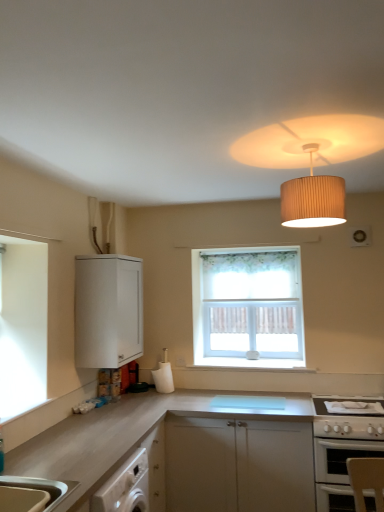
This screenshot has height=512, width=384. Describe the element at coordinates (107, 434) in the screenshot. I see `satin white countertop at center` at that location.

Image resolution: width=384 pixels, height=512 pixels. What do you see at coordinates (313, 198) in the screenshot?
I see `beige pleated lampshade at upper center` at bounding box center [313, 198].

The width and height of the screenshot is (384, 512). What do you see at coordinates (248, 307) in the screenshot?
I see `white floral curtain at center` at bounding box center [248, 307].

Describe the element at coordinates (347, 421) in the screenshot. The height and width of the screenshot is (512, 384). I see `white glossy gas stove at lower right` at that location.

The width and height of the screenshot is (384, 512). In order to click on white matte cabinet at upper left in this screenshot , I will do `click(108, 311)`.

Identify the location of satin white countertop at center. (107, 434).

Considering the positions of objects white glossy oven at lower right and white glossy gas stove at lower right in the image provided, who is more to the left, white glossy oven at lower right or white glossy gas stove at lower right?

white glossy oven at lower right.

Can you confirm if white glossy oven at lower right is smaller than white glossy gas stove at lower right?

Actually, white glossy oven at lower right might be larger than white glossy gas stove at lower right.

What are the coordinates of `gas stove that appears on the right of white glossy oven at lower right` in the screenshot? It's located at (347, 421).

In the image, is white glossy oven at lower right on the left side or the right side of satin white countertop at center?

white glossy oven at lower right is to the right of satin white countertop at center.

In the image, there is a satin white countertop at center. In order to click on oven below it (from the image's perspective) in this screenshot , I will do (342, 451).

Is white glossy oven at lower right not near satin white countertop at center?

No.

Is white glossy oven at lower right positioned beyond the bounds of satin white countertop at center?

Indeed, white glossy oven at lower right is completely outside satin white countertop at center.

Considering the sizes of objects white glossy gas stove at lower right and satin white countertop at center in the image provided, who is smaller, white glossy gas stove at lower right or satin white countertop at center?

With smaller size is white glossy gas stove at lower right.

Are white glossy gas stove at lower right and satin white countertop at center far apart?

They are positioned close to each other.

Is white glossy gas stove at lower right to the left of satin white countertop at center from the viewer's perspective?

No.

Is white matte cabinet at upper left turned away from white floral curtain at center?

That's not correct — white matte cabinet at upper left is not looking away from white floral curtain at center.

Can you confirm if white matte cabinet at upper left is shorter than white floral curtain at center?

Correct, white matte cabinet at upper left is not as tall as white floral curtain at center.

Is white matte cabinet at upper left directly adjacent to white floral curtain at center?

There is a gap between white matte cabinet at upper left and white floral curtain at center.

From the image's perspective, which object appears higher, satin white countertop at center or white glossy gas stove at lower right?

white glossy gas stove at lower right, from the image's perspective.

Is satin white countertop at center turned away from white glossy gas stove at lower right?

No, white glossy gas stove at lower right is not at the back of satin white countertop at center.

Is point (70, 424) less distant than point (371, 437)?

Yes, it is in front of point (371, 437).

Can you see beige pleated lampshade at upper center touching white glossy oven at lower right?

No, beige pleated lampshade at upper center is not next to white glossy oven at lower right.

From a real-world perspective, who is located lower, beige pleated lampshade at upper center or white glossy oven at lower right?

In real-world perspective, white glossy oven at lower right is lower.

Locate an element on the screen. The width and height of the screenshot is (384, 512). oven located behind the beige pleated lampshade at upper center is located at coordinates (342, 451).

In the scene shown: Can you confirm if beige pleated lampshade at upper center is smaller than white glossy oven at lower right?

Yes, beige pleated lampshade at upper center is smaller than white glossy oven at lower right.

Considering the positions of point (316, 192) and point (145, 428), is point (316, 192) closer or farther from the camera than point (145, 428)?

Clearly, point (316, 192) is closer to the camera than point (145, 428).

Considering the relative sizes of beige pleated lampshade at upper center and satin white countertop at center in the image provided, is beige pleated lampshade at upper center thinner than satin white countertop at center?

Yes.

Is beige pleated lampshade at upper center looking in the opposite direction of satin white countertop at center?

No, beige pleated lampshade at upper center is not facing the opposite direction of satin white countertop at center.

Locate an element on the screen. This screenshot has width=384, height=512. gas stove that appears above the white glossy oven at lower right (from a real-world perspective) is located at coordinates (x=347, y=421).

Where is `countertop behind the white glossy oven at lower right`? The height and width of the screenshot is (512, 384). countertop behind the white glossy oven at lower right is located at coordinates (107, 434).

Looking at the image, which one is located further to satin white countertop at center, white floral curtain at center or white matte cabinet at upper left?

Based on the image, white floral curtain at center appears to be further to satin white countertop at center.

Considering their positions, is white matte cabinet at upper left positioned further to white glossy oven at lower right than beige pleated lampshade at upper center?

white matte cabinet at upper left.

Estimate the real-world distances between objects in this image. Which object is further from white floral curtain at center, white glossy gas stove at lower right or satin white countertop at center?

The object further to white floral curtain at center is satin white countertop at center.

Looking at the image, which one is located further to white matte cabinet at upper left, satin white countertop at center or white glossy gas stove at lower right?

The object further to white matte cabinet at upper left is white glossy gas stove at lower right.

Considering their positions, is beige pleated lampshade at upper center positioned further to white glossy oven at lower right than white floral curtain at center?

beige pleated lampshade at upper center is positioned further to the anchor white glossy oven at lower right.

Looking at the image, which one is located further to white floral curtain at center, white glossy oven at lower right or satin white countertop at center?

Among the two, satin white countertop at center is located further to white floral curtain at center.

Which object lies further to the anchor point white floral curtain at center, white glossy oven at lower right or white matte cabinet at upper left?

Based on the image, white glossy oven at lower right appears to be further to white floral curtain at center.

From the picture: Estimate the real-world distances between objects in this image. Which object is further from satin white countertop at center, white glossy gas stove at lower right or white floral curtain at center?

white floral curtain at center is further to satin white countertop at center.

The width and height of the screenshot is (384, 512). Find the location of `oven between satin white countertop at center and white glossy gas stove at lower right in the horizontal direction`. oven between satin white countertop at center and white glossy gas stove at lower right in the horizontal direction is located at coordinates (342, 451).

Locate an element on the screen. The width and height of the screenshot is (384, 512). gas stove located between white glossy oven at lower right and white floral curtain at center in the depth direction is located at coordinates tap(347, 421).

Where is `cabinetry between beige pleated lampshade at upper center and white glossy oven at lower right in the up-down direction`? cabinetry between beige pleated lampshade at upper center and white glossy oven at lower right in the up-down direction is located at coordinates pos(108,311).

Where is `window between white matte cabinet at upper left and satin white countertop at center vertically`? The height and width of the screenshot is (512, 384). window between white matte cabinet at upper left and satin white countertop at center vertically is located at coordinates (248, 307).